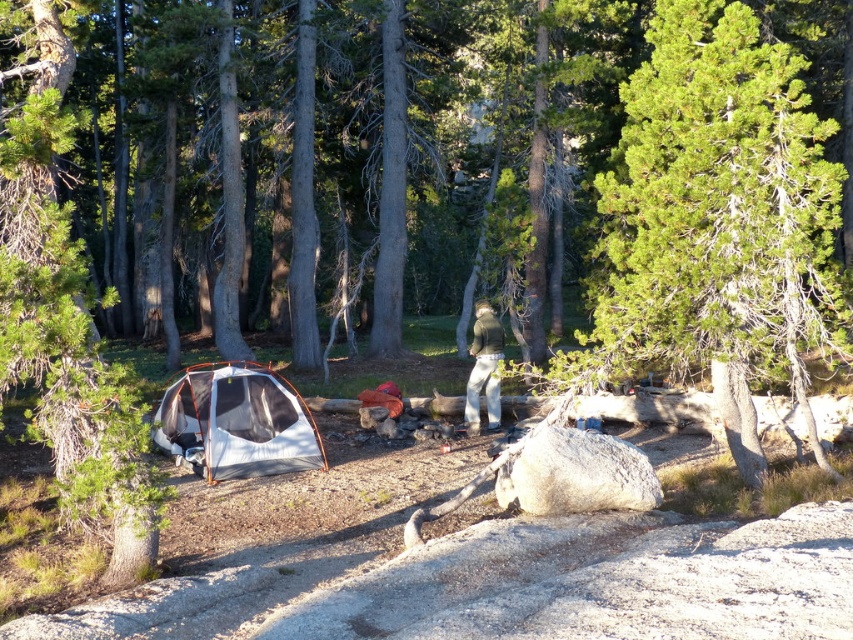
Between white mesh tent at lower left and green fuzzy sweater at center, which one has more height?

With more height is green fuzzy sweater at center.

Is point (209, 444) farther from viewer compared to point (467, 420)?

No, (209, 444) is closer to viewer.

Where is `white mesh tent at lower left`? The height and width of the screenshot is (640, 853). white mesh tent at lower left is located at coordinates (236, 422).

Is point (132, 436) closer to viewer compared to point (198, 387)?

Yes, it is in front of point (198, 387).

In the scene shown: Which of these two, green textured tent at lower left or white mesh tent at lower left, stands shorter?

green textured tent at lower left

Which is behind, point (64, 124) or point (245, 417)?

Point (245, 417)

Locate an element on the screen. The width and height of the screenshot is (853, 640). green textured tent at lower left is located at coordinates (65, 314).

Who is positioned more to the left, green textured tent at lower left or green fuzzy sweater at center?

green textured tent at lower left

Which is in front, point (136, 422) or point (473, 339)?

Point (136, 422)

Find the location of a particular element. The width and height of the screenshot is (853, 640). green textured tent at lower left is located at coordinates (65, 314).